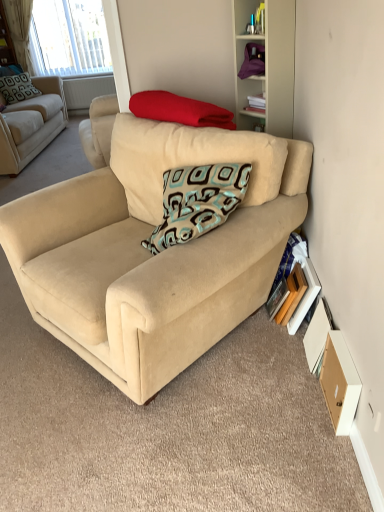
Find the location of `wooden bookshelf at upper center, the 1th shelf positioned from the back`. wooden bookshelf at upper center, the 1th shelf positioned from the back is located at coordinates (6, 41).

Locate an element on the screen. white matte cabinet at upper right is located at coordinates (267, 65).

What do you see at coordinates (305, 296) in the screenshot? The image size is (384, 512). I see `hardcover book at lower right, the 1th paperback book when ordered from right to left` at bounding box center [305, 296].

At what (x,y) coordinates should I click in order to perform the action: click on teal-patterned fabric pillow at upper left, the 1th pillow in the top-to-bottom sequence. Please return your answer as a coordinate pair (x, y). The width and height of the screenshot is (384, 512). Looking at the image, I should click on (17, 88).

How much space does teal-patterned fabric pillow at upper left, the 1th pillow in the top-to-bottom sequence, occupy horizontally?

12.28 inches.

This screenshot has height=512, width=384. I want to click on wooden paperback book at lower right, which appears as the first paperback book when viewed from the left, so click(x=292, y=295).

Locate an element on the screen. The width and height of the screenshot is (384, 512). purple fabric at upper right, the 1th shelf in the bottom-to-top sequence is located at coordinates (253, 61).

Describe the element at coordinates (144, 274) in the screenshot. I see `beige velvety couch at center, the second studio couch in the top-to-bottom sequence` at that location.

The height and width of the screenshot is (512, 384). I want to click on wooden bookshelf at upper center, acting as the 2th shelf starting from the right, so click(6, 41).

Between purple fabric at upper right, marked as the first shelf in a front-to-back arrangement, and teal-patterned fabric pillow at upper left, placed as the 2th pillow when sorted from bottom to top, which one has more height?

Standing taller between the two is teal-patterned fabric pillow at upper left, placed as the 2th pillow when sorted from bottom to top.

Is point (258, 63) closer to viewer compared to point (16, 80)?

Yes.

Can you see purple fabric at upper right, marked as the first shelf in a front-to-back arrangement, touching teal-patterned fabric pillow at upper left, the 1th pillow from the left?

No.

Based on the photo, is teal-patterned fabric pillow at upper left, which appears as the second pillow when viewed from the front, at the back of purple fabric at upper right, marked as the first shelf in a front-to-back arrangement?

No, purple fabric at upper right, marked as the first shelf in a front-to-back arrangement, is not facing the opposite direction of teal-patterned fabric pillow at upper left, which appears as the second pillow when viewed from the front.

Measure the distance from beige fabric couch at upper left, which is counted as the second studio couch, starting from the bottom, to wooden drawer at lower right.

beige fabric couch at upper left, which is counted as the second studio couch, starting from the bottom, and wooden drawer at lower right are 3.81 meters apart from each other.

Does beige fabric couch at upper left, which ranks as the first studio couch in left-to-right order, have a lesser height compared to wooden drawer at lower right?

No.

Can we say beige fabric couch at upper left, the 1th studio couch when ordered from top to bottom, lies outside wooden drawer at lower right?

Yes, beige fabric couch at upper left, the 1th studio couch when ordered from top to bottom, is outside of wooden drawer at lower right.

Which object is more forward, beige fabric couch at upper left, which ranks as the first studio couch in left-to-right order, or wooden drawer at lower right?

Positioned in front is wooden drawer at lower right.

How distant is hardcover book at lower right, the 1th paperback book when ordered from right to left, from wooden paperback book at lower right, which appears as the first paperback book when viewed from the left?

2.36 inches.

Considering the relative sizes of hardcover book at lower right, the 1th paperback book when ordered from right to left, and wooden paperback book at lower right, the 2th paperback book positioned from the right, in the image provided, is hardcover book at lower right, the 1th paperback book when ordered from right to left, thinner than wooden paperback book at lower right, the 2th paperback book positioned from the right,?

No, hardcover book at lower right, the 1th paperback book when ordered from right to left, is not thinner than wooden paperback book at lower right, the 2th paperback book positioned from the right.

Find the location of a particular element. paperback book on the right of wooden paperback book at lower right, the 2th paperback book positioned from the right is located at coordinates (305, 296).

From the image's perspective, is white matte cabinet at upper right located above purple fabric at upper right, which is counted as the second shelf, starting from the back?

Incorrect, from the image's perspective, white matte cabinet at upper right is lower than purple fabric at upper right, which is counted as the second shelf, starting from the back.

Based on the photo, can you confirm if white matte cabinet at upper right is positioned to the left of purple fabric at upper right, the second shelf in the left-to-right sequence?

No, white matte cabinet at upper right is not to the left of purple fabric at upper right, the second shelf in the left-to-right sequence.

Is white matte cabinet at upper right oriented away from purple fabric at upper right, the 2th shelf positioned from the top?

Yes, purple fabric at upper right, the 2th shelf positioned from the top, is at the back of white matte cabinet at upper right.

From a real-world perspective, which is physically below, wooden paperback book at lower right, which appears as the first paperback book when viewed from the left, or teal-patterned fabric pillow at upper left, placed as the 2th pillow when sorted from bottom to top?

wooden paperback book at lower right, which appears as the first paperback book when viewed from the left, is physically lower.

Find the location of a particular element. The image size is (384, 512). pillow that is the 2nd one when counting leftward from the wooden paperback book at lower right, the 2th paperback book positioned from the right is located at coordinates (17, 88).

Between wooden paperback book at lower right, which appears as the first paperback book when viewed from the left, and teal-patterned fabric pillow at upper left, the 1th pillow in the top-to-bottom sequence, which one has smaller width?

With smaller width is wooden paperback book at lower right, which appears as the first paperback book when viewed from the left.

Who is shorter, wooden paperback book at lower right, which appears as the first paperback book when viewed from the left, or teal-patterned fabric pillow at upper left, which is the first pillow in back-to-front order?

wooden paperback book at lower right, which appears as the first paperback book when viewed from the left.

Is beige fabric couch at upper left, marked as the 2th studio couch in a front-to-back arrangement, next to beige velvety couch at center, the second studio couch in the top-to-bottom sequence, and touching it?

beige fabric couch at upper left, marked as the 2th studio couch in a front-to-back arrangement, and beige velvety couch at center, the second studio couch in the top-to-bottom sequence, are not in contact.

Considering the points (21, 147) and (64, 333), which point is in front, point (21, 147) or point (64, 333)?

Positioned in front is point (64, 333).

Is beige fabric couch at upper left, the 1th studio couch when ordered from top to bottom, inside the boundaries of beige velvety couch at center, which is counted as the first studio couch, starting from the bottom, or outside?

beige fabric couch at upper left, the 1th studio couch when ordered from top to bottom, cannot be found inside beige velvety couch at center, which is counted as the first studio couch, starting from the bottom.

From the image's perspective, is beige fabric couch at upper left, the 2th studio couch viewed from the right, located above or below beige velvety couch at center, the second studio couch in the top-to-bottom sequence?

Based on their image positions, beige fabric couch at upper left, the 2th studio couch viewed from the right, is located above beige velvety couch at center, the second studio couch in the top-to-bottom sequence.

From a real-world perspective, between hardcover book at lower right, positioned as the 2th paperback book in left-to-right order, and wooden bookshelf at upper center, the first shelf from the top, who is vertically higher?

wooden bookshelf at upper center, the first shelf from the top, is physically above.

Is the position of hardcover book at lower right, positioned as the 2th paperback book in left-to-right order, more distant than that of wooden bookshelf at upper center, acting as the 2th shelf starting from the right?

No.

Considering the positions of objects hardcover book at lower right, the 1th paperback book when ordered from right to left, and wooden bookshelf at upper center, the 1th shelf positioned from the back, in the image provided, who is more to the left, hardcover book at lower right, the 1th paperback book when ordered from right to left, or wooden bookshelf at upper center, the 1th shelf positioned from the back,?

wooden bookshelf at upper center, the 1th shelf positioned from the back.

Which object is thinner, hardcover book at lower right, the 1th paperback book when ordered from right to left, or wooden bookshelf at upper center, the first shelf in the left-to-right sequence?

hardcover book at lower right, the 1th paperback book when ordered from right to left.

Locate an element on the screen. The image size is (384, 512). pillow behind the purple fabric at upper right, marked as the first shelf in a front-to-back arrangement is located at coordinates (17, 88).

You are a GUI agent. You are given a task and a screenshot of the screen. Output one action in this format:
    pyautogui.click(x=<x>, y=<y>)
    Task: Click on the 2nd studio couch counting from the left of the wooden drawer at lower right
    The height and width of the screenshot is (512, 384).
    Given the screenshot: What is the action you would take?
    pyautogui.click(x=31, y=125)

When comparing their distances from beige velvety couch at center, the second studio couch in the top-to-bottom sequence, does white matte cabinet at upper right or wooden bookshelf at upper center, the second shelf when ordered from front to back, seem further?

The object further to beige velvety couch at center, the second studio couch in the top-to-bottom sequence, is wooden bookshelf at upper center, the second shelf when ordered from front to back.

From the image, which object appears to be nearer to red soft blanket at upper center, the 1th pillow viewed from the right, hardcover book at lower right, the 1th paperback book when ordered from right to left, or wooden drawer at lower right?

hardcover book at lower right, the 1th paperback book when ordered from right to left, is positioned closer to the anchor red soft blanket at upper center, the 1th pillow viewed from the right.

Considering their positions, is purple fabric at upper right, the second shelf in the left-to-right sequence, positioned closer to teal-patterned fabric pillow at upper left, placed as the 2th pillow when sorted from bottom to top, than beige fabric couch at upper left, marked as the 2th studio couch in a front-to-back arrangement?

Among the two, beige fabric couch at upper left, marked as the 2th studio couch in a front-to-back arrangement, is located nearer to teal-patterned fabric pillow at upper left, placed as the 2th pillow when sorted from bottom to top.

Looking at the image, which one is located further to teal-patterned fabric pillow at upper left, acting as the 2th pillow starting from the right, wooden paperback book at lower right, the 2th paperback book positioned from the right, or purple fabric at upper right, which ranks as the 1th shelf in right-to-left order?

wooden paperback book at lower right, the 2th paperback book positioned from the right, lies further to teal-patterned fabric pillow at upper left, acting as the 2th pillow starting from the right, than the other object.

Considering their positions, is beige fabric couch at upper left, marked as the 2th studio couch in a front-to-back arrangement, positioned further to teal-patterned fabric pillow at upper left, the 1th pillow in the top-to-bottom sequence, than red soft blanket at upper center, the second pillow positioned from the left?

red soft blanket at upper center, the second pillow positioned from the left, lies further to teal-patterned fabric pillow at upper left, the 1th pillow in the top-to-bottom sequence, than the other object.

When comparing their distances from red soft blanket at upper center, the 1th pillow viewed from the right, does hardcover book at lower right, the 1th paperback book when ordered from right to left, or wooden bookshelf at upper center, the 2th shelf when ordered from bottom to top, seem further?

The object further to red soft blanket at upper center, the 1th pillow viewed from the right, is wooden bookshelf at upper center, the 2th shelf when ordered from bottom to top.

Based on their spatial positions, is beige fabric couch at upper left, the 2th studio couch viewed from the right, or red soft blanket at upper center, the 1th pillow viewed from the right, further from wooden paperback book at lower right, the 2th paperback book positioned from the right?

Based on the image, beige fabric couch at upper left, the 2th studio couch viewed from the right, appears to be further to wooden paperback book at lower right, the 2th paperback book positioned from the right.

Estimate the real-world distances between objects in this image. Which object is closer to wooden drawer at lower right, wooden paperback book at lower right, which appears as the first paperback book when viewed from the left, or wooden bookshelf at upper center, the second shelf when ordered from front to back?

wooden paperback book at lower right, which appears as the first paperback book when viewed from the left.

The width and height of the screenshot is (384, 512). Identify the location of drawer positioned between beige velvety couch at center, which is the first studio couch in right-to-left order, and teal-patterned fabric pillow at upper left, acting as the 2th pillow starting from the right, from near to far. (339, 382).

Identify the location of shelf located between beige velvety couch at center, placed as the 2th studio couch when sorted from back to front, and beige fabric couch at upper left, the 1th studio couch when ordered from top to bottom, in the depth direction. This screenshot has width=384, height=512. (253, 61).

In order to click on shelf positioned between hardcover book at lower right, the 1th paperback book when ordered from right to left, and teal-patterned fabric pillow at upper left, placed as the 2th pillow when sorted from bottom to top, from near to far in this screenshot , I will do `click(253, 61)`.

Where is `studio couch between beige velvety couch at center, which is the first studio couch in right-to-left order, and teal-patterned fabric pillow at upper left, the 1th pillow from the left, from front to back`? The image size is (384, 512). studio couch between beige velvety couch at center, which is the first studio couch in right-to-left order, and teal-patterned fabric pillow at upper left, the 1th pillow from the left, from front to back is located at coordinates (31, 125).